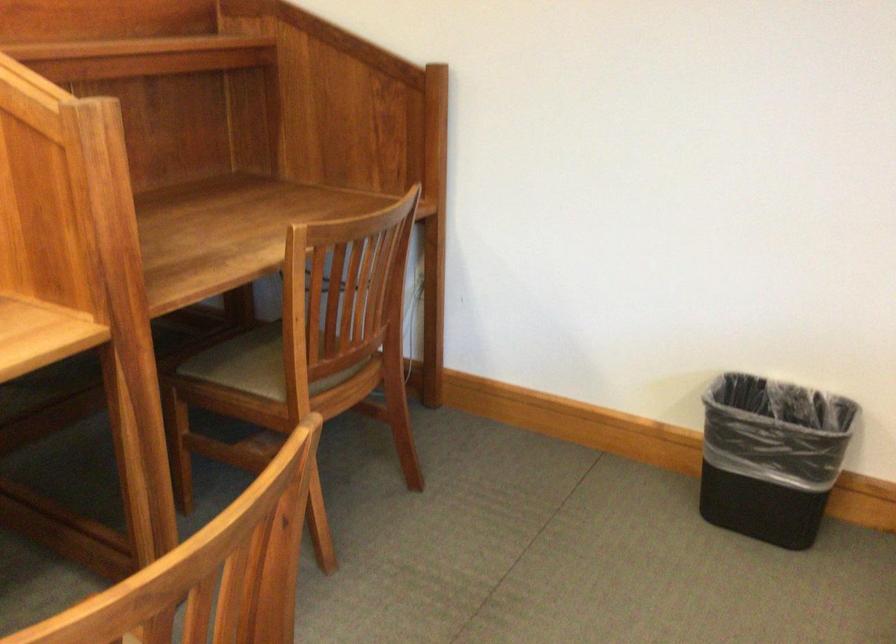
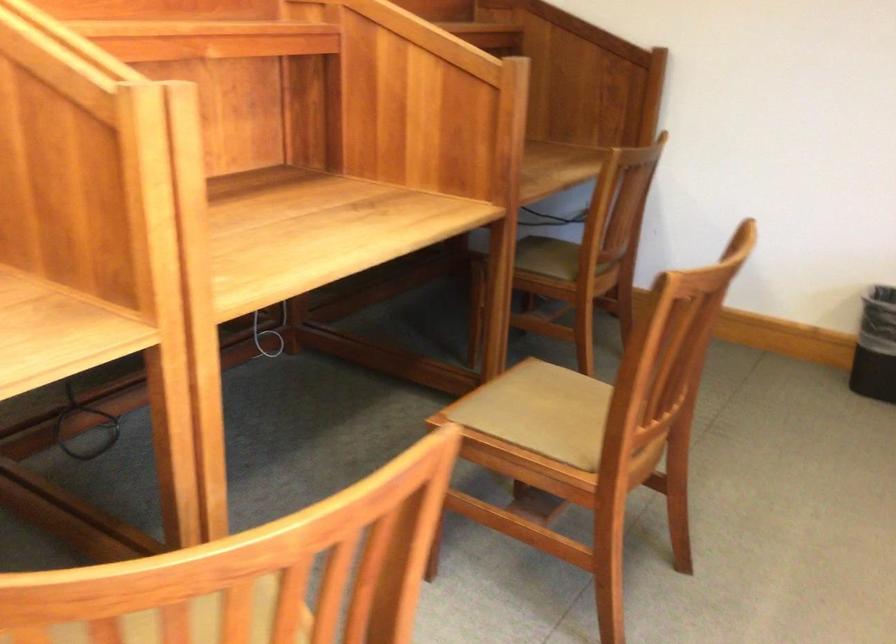
The images are taken continuously from a first-person perspective. In which direction are you moving?

The movement direction of the cameraman is left, backward.